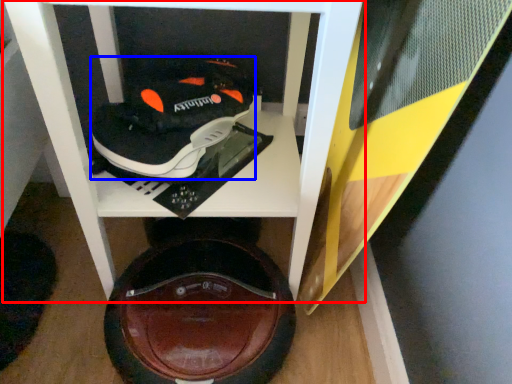
Question: Among these objects, which one is nearest to the camera, furniture (highlighted by a red box) or shoe (highlighted by a blue box)?

Choices:
 (A) furniture
 (B) shoe

Answer: (A)